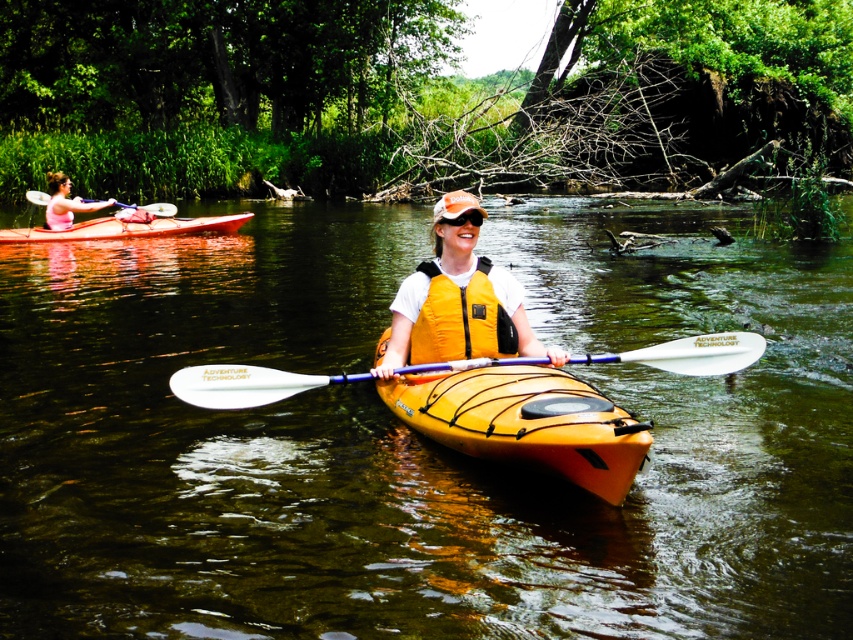
Question: Which point is farther to the camera?

Choices:
 (A) (485, 317)
 (B) (57, 209)

Answer: (B)

Question: Which point appears closest to the camera in this image?

Choices:
 (A) (148, 209)
 (B) (469, 212)

Answer: (B)

Question: Can you confirm if yellow matte kayak at center is wider than pink fabric kayak at upper left?

Choices:
 (A) yes
 (B) no

Answer: (A)

Question: Is yellow matte kayak at center above matte red canoe at left?

Choices:
 (A) yes
 (B) no

Answer: (B)

Question: From the image, what is the correct spatial relationship of yellow kayak at center in relation to yellow life vest at center?

Choices:
 (A) below
 (B) above

Answer: (A)

Question: Among these points, which one is farthest from the camera?

Choices:
 (A) (67, 547)
 (B) (432, 356)

Answer: (B)